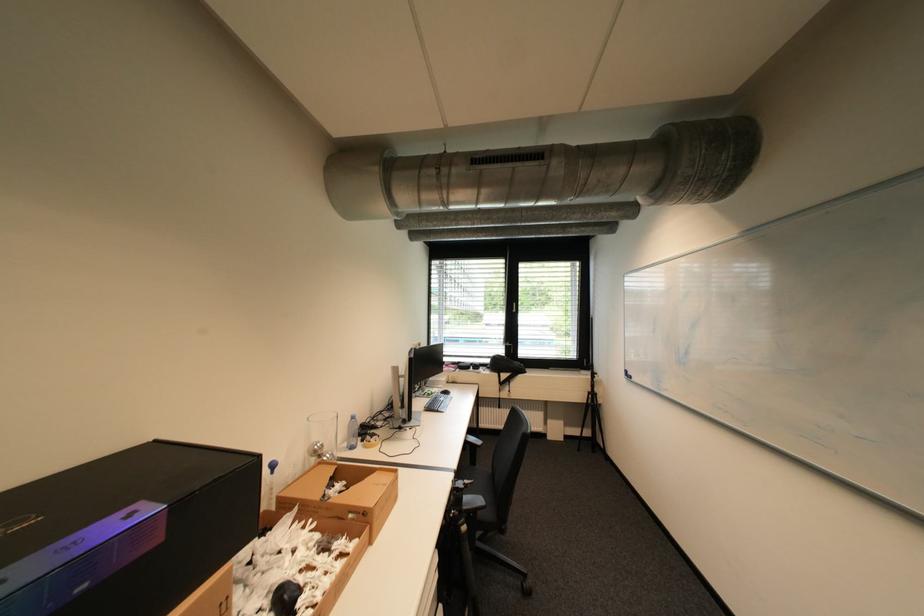
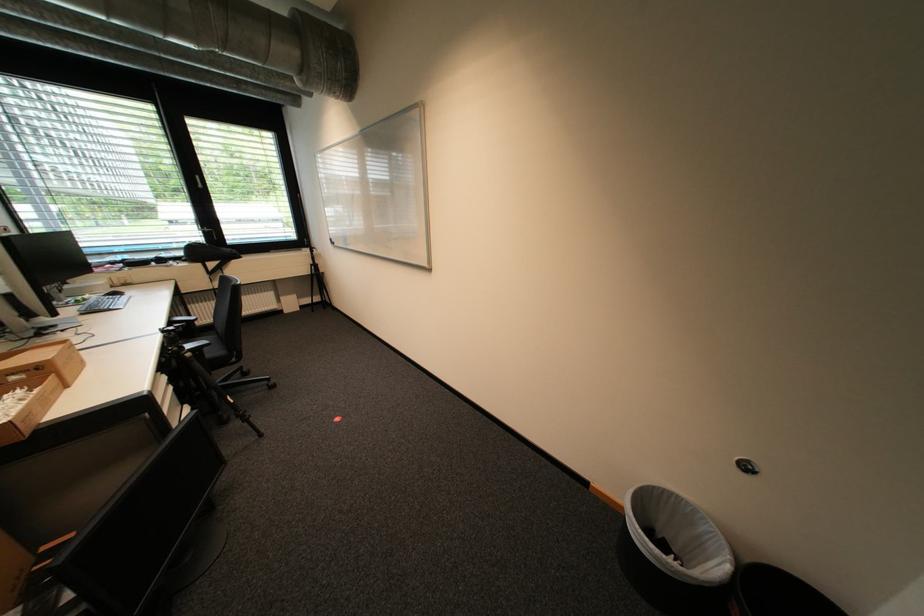
In the second image, find the point that corresponds to the point at 488,513 in the first image.

(213, 350)